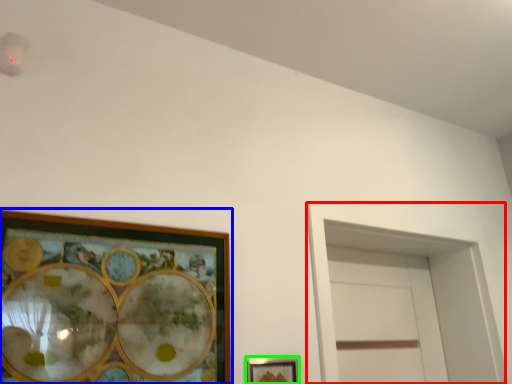
Question: Based on their relative distances, which object is farther from glass door (highlighted by a red box)? Choose from picture frame (highlighted by a blue box) and picture frame (highlighted by a green box).

Choices:
 (A) picture frame
 (B) picture frame

Answer: (A)